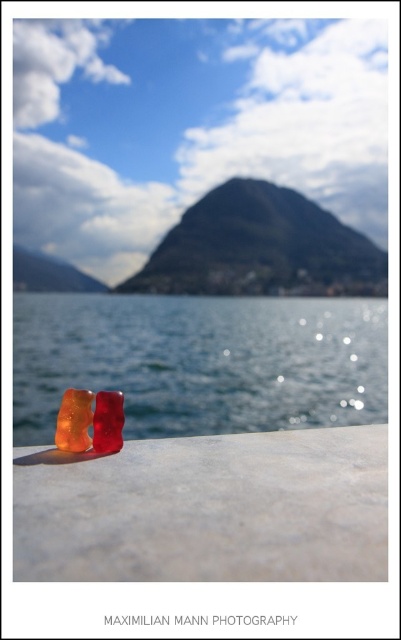
Is smooth brown mountain at center positioned before matte black mountain at upper center?

That is False.

Between smooth brown mountain at center and matte black mountain at upper center, which one has more height?

→ Standing taller between the two is smooth brown mountain at center.

Does point (182, 260) come closer to viewer compared to point (34, 289)?

No, it is not.

At what (x,y) coordinates should I click in order to perform the action: click on smooth brown mountain at center. Please return your answer as a coordinate pair (x, y). Looking at the image, I should click on (261, 248).

Who is positioned more to the left, matte stone gummy bears at center or glistening water at center?

From the viewer's perspective, glistening water at center appears more on the left side.

Does point (180, 442) come behind point (20, 348)?

No.

Who is more distant from viewer, (257, 573) or (322, 397)?

Positioned behind is point (322, 397).

What are the coordinates of `matte stone gummy bears at center` in the screenshot? It's located at (206, 509).

Find the location of a particular element. matte stone gummy bears at center is located at coordinates (206, 509).

Based on the photo, between matte stone gummy bears at center and smooth brown mountain at center, which one is positioned lower?

matte stone gummy bears at center

Where is `matte stone gummy bears at center`? Image resolution: width=401 pixels, height=640 pixels. matte stone gummy bears at center is located at coordinates (206, 509).

Identify the location of matte stone gummy bears at center. This screenshot has width=401, height=640. (206, 509).